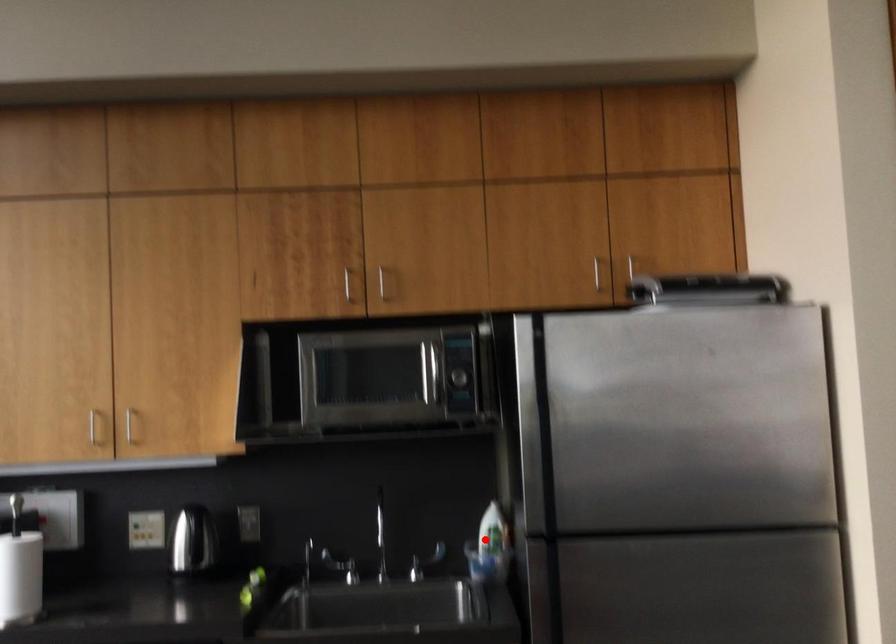
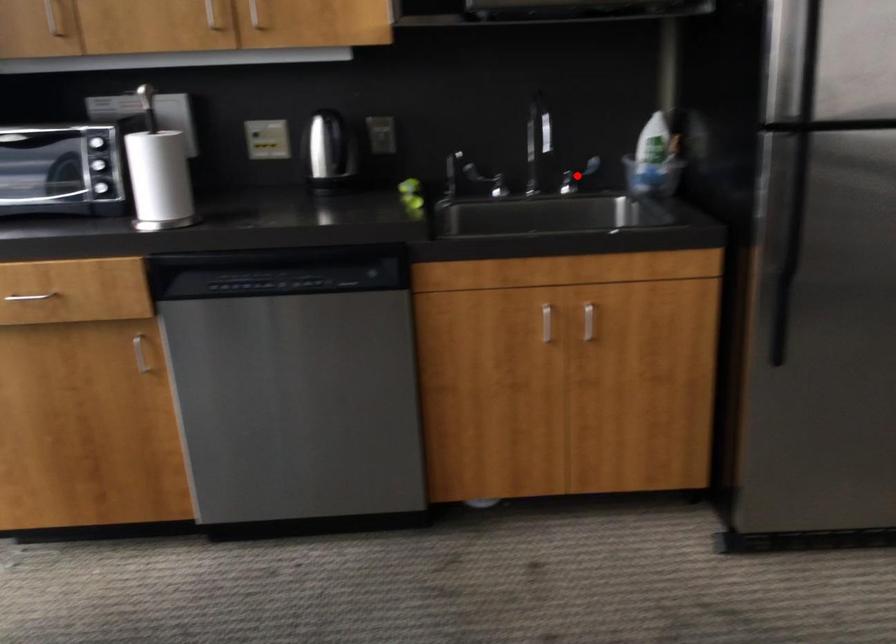
I am providing you with two images of the same scene from different viewpoints. A red point is marked on the first image and another point is marked on the second image. Are the points marked in image1 and image2 representing the same 3D position?

No